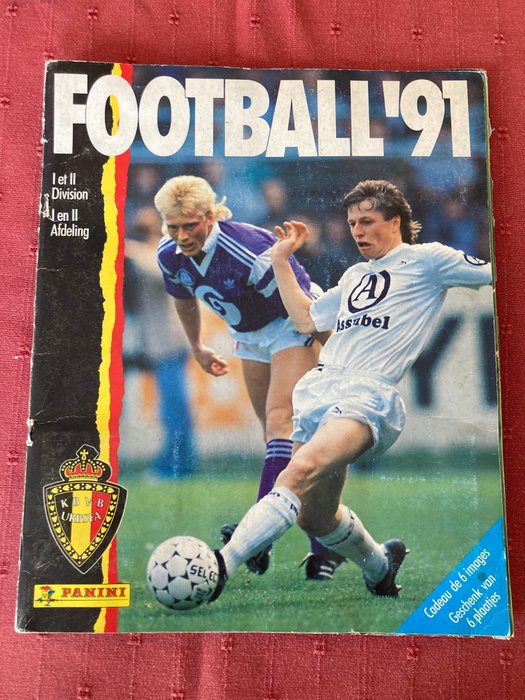
At what (x,y) coordinates should I click in order to perform the action: click on purple sock. Please return your answer as a coordinate pair (x, y). The width and height of the screenshot is (525, 700). Looking at the image, I should click on pos(317,547), pos(269,467).